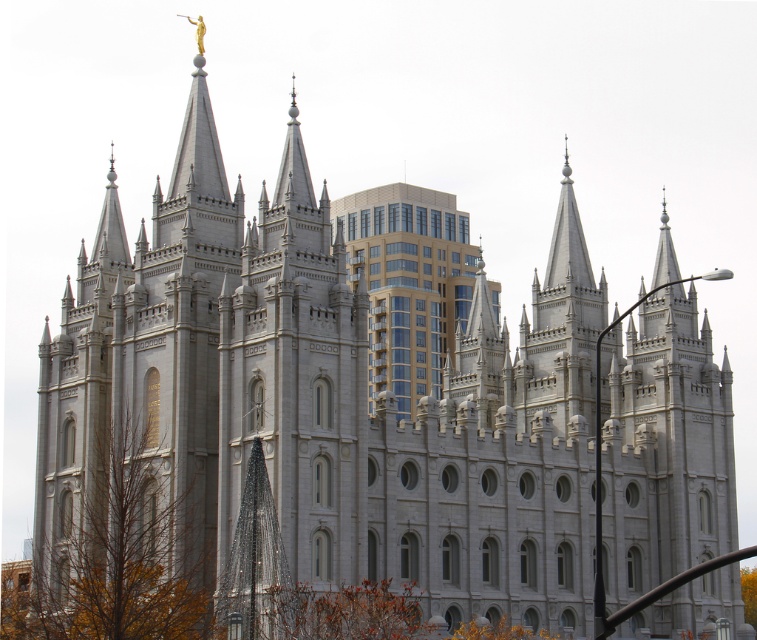
You are standing in front of the historic temple and see two brown leafy trees in the foreground. Which tree is nearer to you, the brown leafy tree at lower left or the brown leafy tree at lower center?

The brown leafy tree at lower left is closer to the viewer than the brown leafy tree at lower center, so the one at lower left is nearer to you.